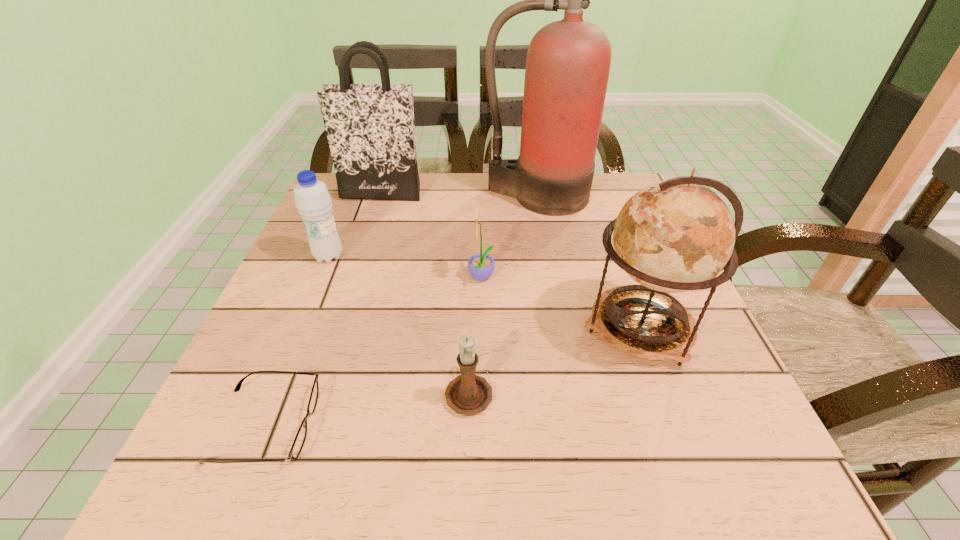
Image resolution: width=960 pixels, height=540 pixels. I want to click on free space located 0.190m at the center of the globe, so click(478, 328).

I want to click on free space located at the center of the globe, so click(500, 328).

Find the location of `vacant position located 0.250m at the center of the globe`. vacant position located 0.250m at the center of the globe is located at coordinates (445, 328).

The image size is (960, 540). Find the location of `free space located on the right of the third farthest object`. free space located on the right of the third farthest object is located at coordinates (376, 256).

This screenshot has width=960, height=540. Find the location of `free region located on the front-facing side of the sunflower`. free region located on the front-facing side of the sunflower is located at coordinates (385, 279).

Image resolution: width=960 pixels, height=540 pixels. I want to click on blank area located 0.190m on the front-facing side of the sunflower, so click(x=375, y=279).

The image size is (960, 540). I want to click on vacant area located 0.100m on the front-facing side of the sunflower, so click(420, 279).

Identify the location of vacant space located on the side of the sixth tallest object with the handle. (471, 278).

Where is `free space located 0.050m on the side of the sixth tallest object with the handle`? This screenshot has height=540, width=960. free space located 0.050m on the side of the sixth tallest object with the handle is located at coordinates (469, 345).

This screenshot has height=540, width=960. Find the location of `vacant space located 0.050m on the side of the sixth tallest object with the handle`. vacant space located 0.050m on the side of the sixth tallest object with the handle is located at coordinates tap(469, 345).